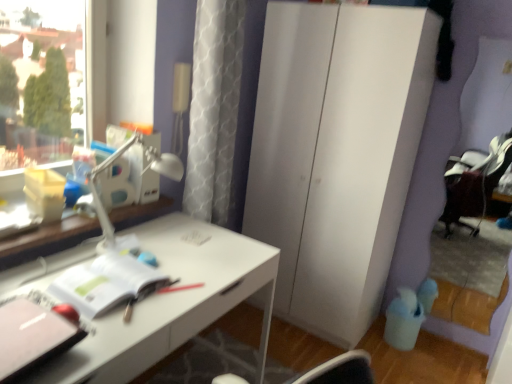
This screenshot has height=384, width=512. Describe the element at coordinates (32, 337) in the screenshot. I see `pink matte notebook at lower left, marked as the 2th notebook in a back-to-front arrangement` at that location.

Describe the element at coordinates (336, 154) in the screenshot. I see `white matte cabinet at center` at that location.

This screenshot has width=512, height=384. What do you see at coordinates (106, 283) in the screenshot? I see `white matte notebook at center, which is counted as the second notebook, starting from the front` at bounding box center [106, 283].

Locate an element on the screen. white glossy desk at center is located at coordinates (172, 301).

What are the coordinates of `white plastic table lamp at upper left` in the screenshot? It's located at (148, 166).

From the image's perspective, which object appears higher, white matte cabinet at center or white glossy desk at center?

From the image's view, white matte cabinet at center is above.

How different are the orientations of white matte cabinet at center and white glossy desk at center in degrees?

They differ by 91.1 degrees in their facing directions.

Considering the sizes of objects white matte cabinet at center and white glossy desk at center in the image provided, who is smaller, white matte cabinet at center or white glossy desk at center?

Smaller between the two is white glossy desk at center.

From a real-world perspective, who is located lower, white matte cabinet at center or white glossy desk at center?

white glossy desk at center.

Is white plastic table lamp at upper left oriented away from white matte notebook at center, which is counted as the second notebook, starting from the front?

No, white plastic table lamp at upper left is not facing the opposite direction of white matte notebook at center, which is counted as the second notebook, starting from the front.

Does white plastic table lamp at upper left have a greater width compared to white matte notebook at center, the 1th notebook when ordered from back to front?

No, white plastic table lamp at upper left is not wider than white matte notebook at center, the 1th notebook when ordered from back to front.

Considering the sizes of white plastic table lamp at upper left and white matte notebook at center, which is counted as the second notebook, starting from the front, in the image, is white plastic table lamp at upper left taller or shorter than white matte notebook at center, which is counted as the second notebook, starting from the front,?

Clearly, white plastic table lamp at upper left is taller compared to white matte notebook at center, which is counted as the second notebook, starting from the front.

Is white plastic table lamp at upper left directly adjacent to white matte notebook at center, which is counted as the second notebook, starting from the front?

No, white plastic table lamp at upper left is not touching white matte notebook at center, which is counted as the second notebook, starting from the front.

Which of these two, pink matte notebook at lower left, the 1th notebook in the front-to-back sequence, or white plastic table lamp at upper left, is bigger?

→ Bigger between the two is white plastic table lamp at upper left.

From the image's perspective, relative to white plastic table lamp at upper left, is pink matte notebook at lower left, the 1th notebook in the front-to-back sequence, above or below?

From the image's perspective, pink matte notebook at lower left, the 1th notebook in the front-to-back sequence, appears below white plastic table lamp at upper left.

Considering the sizes of objects pink matte notebook at lower left, the 1th notebook in the front-to-back sequence, and white plastic table lamp at upper left in the image provided, who is wider, pink matte notebook at lower left, the 1th notebook in the front-to-back sequence, or white plastic table lamp at upper left?

pink matte notebook at lower left, the 1th notebook in the front-to-back sequence, is wider.

Is pink matte notebook at lower left, the 1th notebook in the front-to-back sequence, facing away from white plastic table lamp at upper left?

No, white plastic table lamp at upper left is not at the back of pink matte notebook at lower left, the 1th notebook in the front-to-back sequence.

Identify the location of the 2nd notebook positioned above the white glossy desk at center (from a real-world perspective). The height and width of the screenshot is (384, 512). (32, 337).

Considering the positions of objects white glossy desk at center and pink matte notebook at lower left, marked as the 2th notebook in a back-to-front arrangement, in the image provided, who is in front, white glossy desk at center or pink matte notebook at lower left, marked as the 2th notebook in a back-to-front arrangement,?

pink matte notebook at lower left, marked as the 2th notebook in a back-to-front arrangement, is closer to the camera.

Is pink matte notebook at lower left, marked as the 2th notebook in a back-to-front arrangement, far from white matte notebook at center, the 1th notebook when ordered from back to front?

Actually, pink matte notebook at lower left, marked as the 2th notebook in a back-to-front arrangement, and white matte notebook at center, the 1th notebook when ordered from back to front, are a little close together.

Considering the positions of objects pink matte notebook at lower left, the 1th notebook in the front-to-back sequence, and white matte notebook at center, which is counted as the second notebook, starting from the front, in the image provided, who is in front, pink matte notebook at lower left, the 1th notebook in the front-to-back sequence, or white matte notebook at center, which is counted as the second notebook, starting from the front,?

pink matte notebook at lower left, the 1th notebook in the front-to-back sequence, is closer to the camera.

Between point (58, 331) and point (68, 289), which one is positioned behind?

The point (68, 289) is farther.

Which of these two, white matte cabinet at center or pink matte notebook at lower left, the 1th notebook in the front-to-back sequence, is wider?

white matte cabinet at center.

Does point (309, 39) lie in front of point (12, 340)?

No, (309, 39) is further to viewer.

Is white matte cabinet at center located outside pink matte notebook at lower left, marked as the 2th notebook in a back-to-front arrangement?

Indeed, white matte cabinet at center is completely outside pink matte notebook at lower left, marked as the 2th notebook in a back-to-front arrangement.

From the image's perspective, is white matte cabinet at center on top of pink matte notebook at lower left, marked as the 2th notebook in a back-to-front arrangement?

Yes, from the image's perspective, white matte cabinet at center is over pink matte notebook at lower left, marked as the 2th notebook in a back-to-front arrangement.

In the scene shown: How different are the orientations of white plastic table lamp at upper left and white matte cabinet at center in degrees?

92 degrees separate the facing orientations of white plastic table lamp at upper left and white matte cabinet at center.

From the image's perspective, is white plastic table lamp at upper left located above or below white matte cabinet at center?

Based on their image positions, white plastic table lamp at upper left is located beneath white matte cabinet at center.

From a real-world perspective, who is located higher, white plastic table lamp at upper left or white matte cabinet at center?

From a 3D spatial view, white plastic table lamp at upper left is above.

Where is `dresser above the white plastic table lamp at upper left (from the image's perspective)`? dresser above the white plastic table lamp at upper left (from the image's perspective) is located at coordinates (336, 154).

The image size is (512, 384). What are the coordinates of `dresser above the white glossy desk at center (from the image's perspective)` in the screenshot? It's located at (336, 154).

Find the location of `the 2nd notebook directly beneath the white plastic table lamp at upper left (from a real-world perspective)`. the 2nd notebook directly beneath the white plastic table lamp at upper left (from a real-world perspective) is located at coordinates (106, 283).

Estimate the real-world distances between objects in this image. Which object is closer to white plastic table lamp at upper left, white glossy desk at center or white matte notebook at center, the 1th notebook when ordered from back to front?

white matte notebook at center, the 1th notebook when ordered from back to front.

Looking at the image, which one is located further to white plastic table lamp at upper left, white matte cabinet at center or pink matte notebook at lower left, marked as the 2th notebook in a back-to-front arrangement?

Based on the image, white matte cabinet at center appears to be further to white plastic table lamp at upper left.

Considering their positions, is pink matte notebook at lower left, marked as the 2th notebook in a back-to-front arrangement, positioned further to white matte cabinet at center than white matte notebook at center, the 1th notebook when ordered from back to front?

pink matte notebook at lower left, marked as the 2th notebook in a back-to-front arrangement, is further to white matte cabinet at center.

Looking at the image, which one is located further to white matte notebook at center, which is counted as the second notebook, starting from the front, white glossy desk at center or white plastic table lamp at upper left?

Based on the image, white plastic table lamp at upper left appears to be further to white matte notebook at center, which is counted as the second notebook, starting from the front.

From the image, which object appears to be farther from white glossy desk at center, white matte notebook at center, which is counted as the second notebook, starting from the front, or pink matte notebook at lower left, the 1th notebook in the front-to-back sequence?

pink matte notebook at lower left, the 1th notebook in the front-to-back sequence.

Which object lies further to the anchor point white matte cabinet at center, white matte notebook at center, the 1th notebook when ordered from back to front, or white plastic table lamp at upper left?

white matte notebook at center, the 1th notebook when ordered from back to front, is further to white matte cabinet at center.

Looking at this image, estimate the real-world distances between objects in this image. Which object is further from white matte notebook at center, which is counted as the second notebook, starting from the front, pink matte notebook at lower left, marked as the 2th notebook in a back-to-front arrangement, or white plastic table lamp at upper left?

white plastic table lamp at upper left lies further to white matte notebook at center, which is counted as the second notebook, starting from the front, than the other object.

From the picture: When comparing their distances from white plastic table lamp at upper left, does pink matte notebook at lower left, marked as the 2th notebook in a back-to-front arrangement, or white glossy desk at center seem closer?

Based on the image, white glossy desk at center appears to be nearer to white plastic table lamp at upper left.

Locate an element on the screen. table lamp between pink matte notebook at lower left, the 1th notebook in the front-to-back sequence, and white matte cabinet at center, in the horizontal direction is located at coordinates (148, 166).

The height and width of the screenshot is (384, 512). I want to click on notebook between white matte notebook at center, which is counted as the second notebook, starting from the front, and white glossy desk at center in the up-down direction, so click(x=32, y=337).

Where is `desk between white matte notebook at center, the 1th notebook when ordered from back to front, and white matte cabinet at center from left to right`? desk between white matte notebook at center, the 1th notebook when ordered from back to front, and white matte cabinet at center from left to right is located at coordinates (172, 301).

Locate an element on the screen. table lamp between white glossy desk at center and white matte cabinet at center is located at coordinates (148, 166).